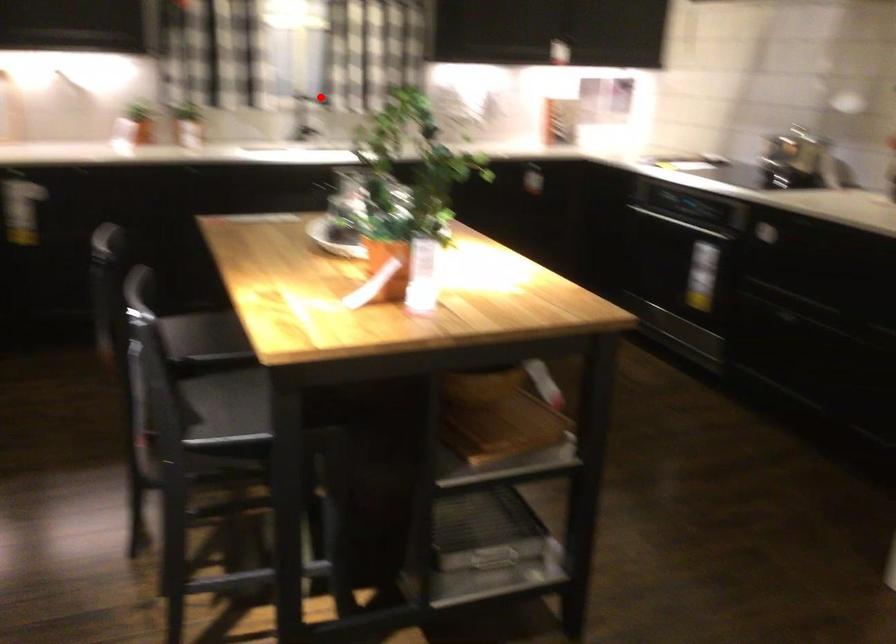
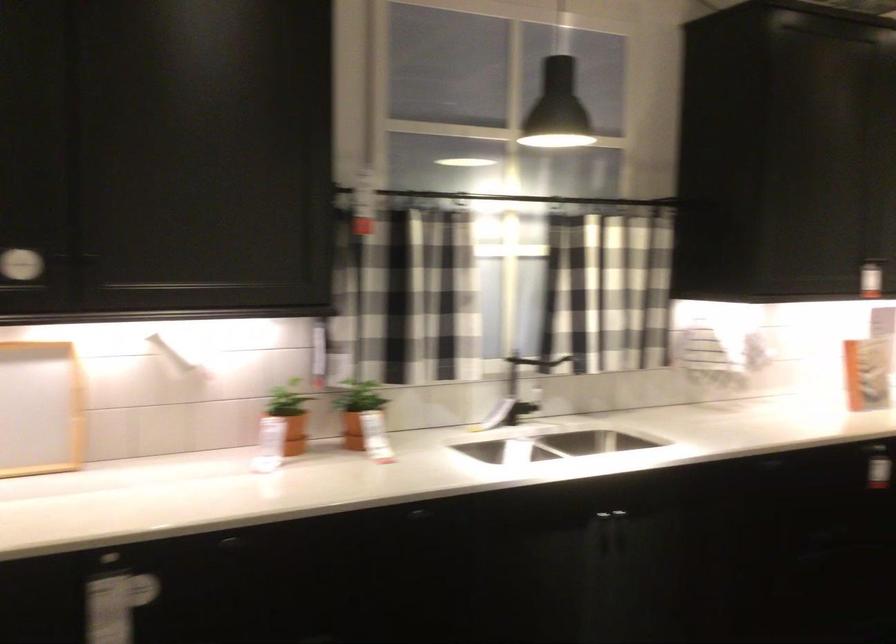
The point at the highlighted location is marked in the first image. Where is the corresponding point in the second image?

(538, 366)